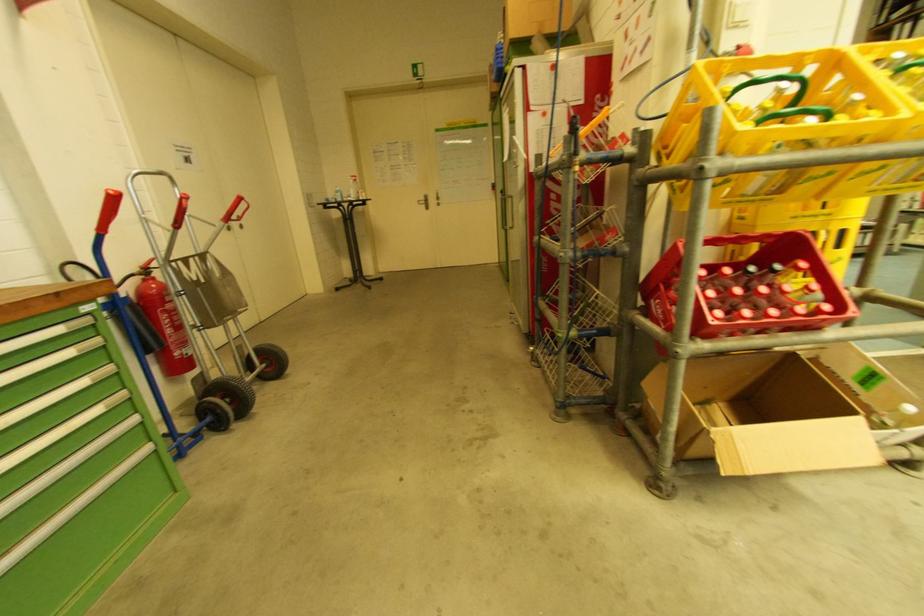
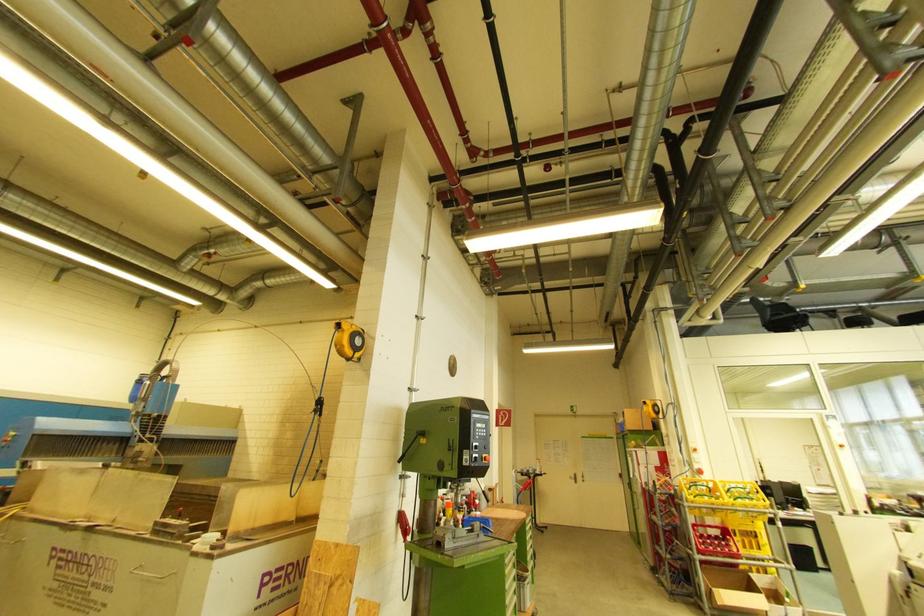
In the second image, find the point that corresponds to [719,435] in the first image.

(716, 593)